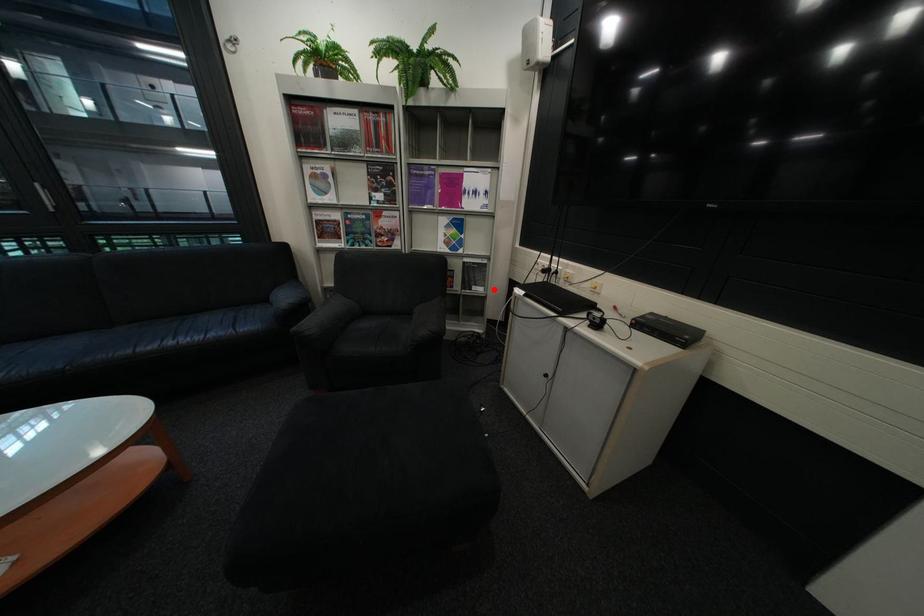
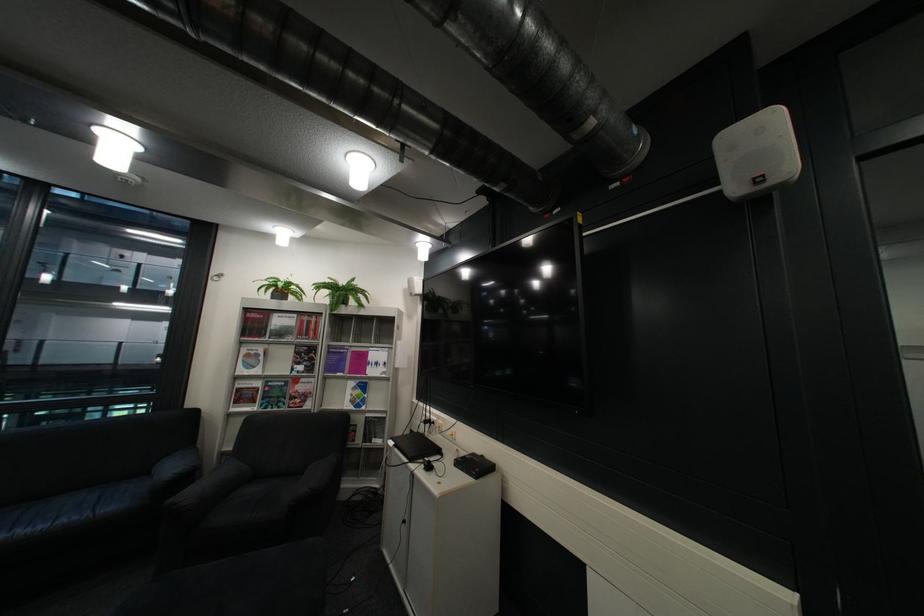
The point at the highlighted location is marked in the first image. Where is the corresponding point in the second image?

(393, 442)